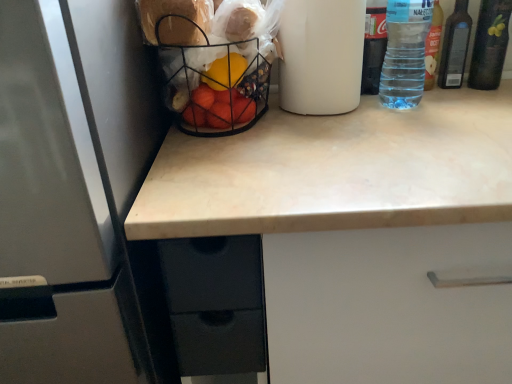
Find the location of a particular element. This screenshot has height=384, width=512. transparent plastic bottle at upper right, arranged as the 3th bottle when viewed from the right is located at coordinates (405, 53).

What do you see at coordinates (490, 44) in the screenshot? Image resolution: width=512 pixels, height=384 pixels. I see `dark green glass bottle at upper right, the 1th bottle in the right-to-left sequence` at bounding box center [490, 44].

What do you see at coordinates (455, 47) in the screenshot? I see `clear plastic bottle at upper right, the second bottle positioned from the right` at bounding box center [455, 47].

You are a GUI agent. You are given a task and a screenshot of the screen. Output one action in this format:
    pyautogui.click(x=<x>, y=<y>)
    Task: Click on the transparent plastic bottle at upper right, the fourth bottle when ordered from right to left
    The height and width of the screenshot is (384, 512).
    Given the screenshot: What is the action you would take?
    [373, 49]

Locate an element on the screen. The width and height of the screenshot is (512, 384). beige marble countertop at center is located at coordinates (359, 232).

The width and height of the screenshot is (512, 384). In order to click on transparent plastic bottle at upper right, arranged as the 3th bottle when viewed from the right in this screenshot , I will do `click(405, 53)`.

Is transparent plastic bottle at upper right, which ranks as the 1th bottle in left-to-right order, looking in the opposite direction of wire mesh basket at center?

transparent plastic bottle at upper right, which ranks as the 1th bottle in left-to-right order, is not turned away from wire mesh basket at center.

Is point (362, 69) farther from camera compared to point (248, 127)?

That is True.

Is transparent plastic bottle at upper right, which ranks as the 1th bottle in left-to-right order, wider or thinner than wire mesh basket at center?

Considering their sizes, transparent plastic bottle at upper right, which ranks as the 1th bottle in left-to-right order, looks slimmer than wire mesh basket at center.

Does transparent plastic bottle at upper right, the fourth bottle when ordered from right to left, have a larger size compared to wire mesh basket at center?

No, transparent plastic bottle at upper right, the fourth bottle when ordered from right to left, is not bigger than wire mesh basket at center.

Does wire mesh basket at center turn towards transparent plastic bottle at upper right, arranged as the 3th bottle when viewed from the right?

No, wire mesh basket at center does not turn towards transparent plastic bottle at upper right, arranged as the 3th bottle when viewed from the right.

Considering the relative positions of wire mesh basket at center and transparent plastic bottle at upper right, arranged as the 3th bottle when viewed from the right, in the image provided, is wire mesh basket at center to the left of transparent plastic bottle at upper right, arranged as the 3th bottle when viewed from the right, from the viewer's perspective?

Correct, you'll find wire mesh basket at center to the left of transparent plastic bottle at upper right, arranged as the 3th bottle when viewed from the right.

Is point (249, 122) farther from camera compared to point (413, 100)?

That is False.

Based on the photo, is clear plastic bottle at upper right, positioned as the third bottle in left-to-right order, positioned beyond the bounds of dark green glass bottle at upper right, the 1th bottle in the right-to-left sequence?

Yes, clear plastic bottle at upper right, positioned as the third bottle in left-to-right order, is located beyond the bounds of dark green glass bottle at upper right, the 1th bottle in the right-to-left sequence.

From a real-world perspective, between clear plastic bottle at upper right, the second bottle positioned from the right, and dark green glass bottle at upper right, which is the 4th bottle in left-to-right order, who is vertically lower?

From a 3D spatial view, clear plastic bottle at upper right, the second bottle positioned from the right, is below.

Find the location of a particular element. bottle that is the 2nd one when counting upward from the clear plastic bottle at upper right, positioned as the third bottle in left-to-right order (from the image's perspective) is located at coordinates (490, 44).

Does clear plastic bottle at upper right, the second bottle positioned from the right, have a greater height compared to dark green glass bottle at upper right, which is the 4th bottle in left-to-right order?

Incorrect, the height of clear plastic bottle at upper right, the second bottle positioned from the right, is not larger of that of dark green glass bottle at upper right, which is the 4th bottle in left-to-right order.

This screenshot has width=512, height=384. In order to click on the 1st bottle located beneath the transparent plastic bottle at upper right, arranged as the 3th bottle when viewed from the right (from a real-world perspective) in this screenshot , I will do `click(373, 49)`.

Between transparent plastic bottle at upper right, which ranks as the 1th bottle in left-to-right order, and transparent plastic bottle at upper right, arranged as the 3th bottle when viewed from the right, which one appears on the left side from the viewer's perspective?

From the viewer's perspective, transparent plastic bottle at upper right, which ranks as the 1th bottle in left-to-right order, appears more on the left side.

Considering the sizes of objects transparent plastic bottle at upper right, which ranks as the 1th bottle in left-to-right order, and transparent plastic bottle at upper right, arranged as the 3th bottle when viewed from the right, in the image provided, who is thinner, transparent plastic bottle at upper right, which ranks as the 1th bottle in left-to-right order, or transparent plastic bottle at upper right, arranged as the 3th bottle when viewed from the right,?

Thinner between the two is transparent plastic bottle at upper right, which ranks as the 1th bottle in left-to-right order.

Is transparent plastic bottle at upper right, arranged as the 2th bottle when viewed from the left, at the back of transparent plastic bottle at upper right, which ranks as the 1th bottle in left-to-right order?

transparent plastic bottle at upper right, which ranks as the 1th bottle in left-to-right order, is not turned away from transparent plastic bottle at upper right, arranged as the 2th bottle when viewed from the left.

Is satin white refrigerator at left to the left or to the right of transparent plastic bottle at upper right, arranged as the 3th bottle when viewed from the right, in the image?

From the image, it's evident that satin white refrigerator at left is to the left of transparent plastic bottle at upper right, arranged as the 3th bottle when viewed from the right.

Starting from the satin white refrigerator at left, which bottle is the 1st one behind? Please provide its 2D coordinates.

[(405, 53)]

Would you say satin white refrigerator at left is outside transparent plastic bottle at upper right, arranged as the 3th bottle when viewed from the right?

Indeed, satin white refrigerator at left is completely outside transparent plastic bottle at upper right, arranged as the 3th bottle when viewed from the right.

Who is taller, satin white refrigerator at left or transparent plastic bottle at upper right, arranged as the 2th bottle when viewed from the left?

A: Standing taller between the two is satin white refrigerator at left.

Which object is wider, clear plastic bottle at upper right, positioned as the third bottle in left-to-right order, or transparent plastic bottle at upper right, which ranks as the 1th bottle in left-to-right order?

With larger width is transparent plastic bottle at upper right, which ranks as the 1th bottle in left-to-right order.

Which is correct: clear plastic bottle at upper right, the second bottle positioned from the right, is inside transparent plastic bottle at upper right, the fourth bottle when ordered from right to left, or outside of it?

clear plastic bottle at upper right, the second bottle positioned from the right, lies outside transparent plastic bottle at upper right, the fourth bottle when ordered from right to left.

From a real-world perspective, is clear plastic bottle at upper right, the second bottle positioned from the right, positioned above or below transparent plastic bottle at upper right, the fourth bottle when ordered from right to left?

clear plastic bottle at upper right, the second bottle positioned from the right, is below transparent plastic bottle at upper right, the fourth bottle when ordered from right to left.

Is clear plastic bottle at upper right, the second bottle positioned from the right, shorter than transparent plastic bottle at upper right, which ranks as the 1th bottle in left-to-right order?

Yes.

Can you confirm if transparent plastic bottle at upper right, arranged as the 2th bottle when viewed from the left, is shorter than clear plastic bottle at upper right, positioned as the third bottle in left-to-right order?

Incorrect, the height of transparent plastic bottle at upper right, arranged as the 2th bottle when viewed from the left, does not fall short of that of clear plastic bottle at upper right, positioned as the third bottle in left-to-right order.

Is transparent plastic bottle at upper right, arranged as the 3th bottle when viewed from the right, positioned far away from clear plastic bottle at upper right, positioned as the third bottle in left-to-right order?

That's not correct — transparent plastic bottle at upper right, arranged as the 3th bottle when viewed from the right, is a little close to clear plastic bottle at upper right, positioned as the third bottle in left-to-right order.

From the image's perspective, would you say transparent plastic bottle at upper right, arranged as the 3th bottle when viewed from the right, is shown under clear plastic bottle at upper right, positioned as the third bottle in left-to-right order?

Yes, from the image's perspective, transparent plastic bottle at upper right, arranged as the 3th bottle when viewed from the right, is beneath clear plastic bottle at upper right, positioned as the third bottle in left-to-right order.

Is transparent plastic bottle at upper right, arranged as the 2th bottle when viewed from the left, facing away from clear plastic bottle at upper right, the second bottle positioned from the right?

That's not correct — transparent plastic bottle at upper right, arranged as the 2th bottle when viewed from the left, is not looking away from clear plastic bottle at upper right, the second bottle positioned from the right.

At what (x,y) coordinates should I click in order to perform the action: click on basket on the left side of transparent plastic bottle at upper right, the fourth bottle when ordered from right to left. Please return your answer as a coordinate pair (x, y). This screenshot has width=512, height=384. Looking at the image, I should click on (214, 84).

You are a GUI agent. You are given a task and a screenshot of the screen. Output one action in this format:
    pyautogui.click(x=<x>, y=<y>)
    Task: Click on the basket in front of the transparent plastic bottle at upper right, arranged as the 3th bottle when viewed from the right
    
    Given the screenshot: What is the action you would take?
    pos(214,84)

Estimate the real-world distances between objects in this image. Which object is closer to clear plastic bottle at upper right, positioned as the third bottle in left-to-right order, beige marble countertop at center or dark green glass bottle at upper right, which is the 4th bottle in left-to-right order?

dark green glass bottle at upper right, which is the 4th bottle in left-to-right order, lies closer to clear plastic bottle at upper right, positioned as the third bottle in left-to-right order, than the other object.

Looking at the image, which one is located closer to clear plastic bottle at upper right, the second bottle positioned from the right, dark green glass bottle at upper right, the 1th bottle in the right-to-left sequence, or wire mesh basket at center?

dark green glass bottle at upper right, the 1th bottle in the right-to-left sequence.

Looking at the image, which one is located closer to transparent plastic bottle at upper right, arranged as the 3th bottle when viewed from the right, wire mesh basket at center or transparent plastic bottle at upper right, the fourth bottle when ordered from right to left?

The object closer to transparent plastic bottle at upper right, arranged as the 3th bottle when viewed from the right, is transparent plastic bottle at upper right, the fourth bottle when ordered from right to left.

Considering their positions, is clear plastic bottle at upper right, positioned as the third bottle in left-to-right order, positioned further to dark green glass bottle at upper right, which is the 4th bottle in left-to-right order, than transparent plastic bottle at upper right, arranged as the 2th bottle when viewed from the left?

transparent plastic bottle at upper right, arranged as the 2th bottle when viewed from the left.

Considering their positions, is transparent plastic bottle at upper right, arranged as the 2th bottle when viewed from the left, positioned further to clear plastic bottle at upper right, the second bottle positioned from the right, than satin white refrigerator at left?

Based on the image, satin white refrigerator at left appears to be further to clear plastic bottle at upper right, the second bottle positioned from the right.

Considering their positions, is satin white refrigerator at left positioned closer to dark green glass bottle at upper right, which is the 4th bottle in left-to-right order, than beige marble countertop at center?

beige marble countertop at center.

Considering their positions, is transparent plastic bottle at upper right, the fourth bottle when ordered from right to left, positioned closer to clear plastic bottle at upper right, the second bottle positioned from the right, than transparent plastic bottle at upper right, arranged as the 3th bottle when viewed from the right?

The object closer to clear plastic bottle at upper right, the second bottle positioned from the right, is transparent plastic bottle at upper right, the fourth bottle when ordered from right to left.

Based on their spatial positions, is transparent plastic bottle at upper right, the fourth bottle when ordered from right to left, or beige marble countertop at center closer to dark green glass bottle at upper right, the 1th bottle in the right-to-left sequence?

transparent plastic bottle at upper right, the fourth bottle when ordered from right to left.

Locate an element on the screen. basket between clear plastic bottle at upper right, the second bottle positioned from the right, and beige marble countertop at center vertically is located at coordinates (214, 84).

This screenshot has width=512, height=384. I want to click on countertop between satin white refrigerator at left and clear plastic bottle at upper right, positioned as the third bottle in left-to-right order, so click(x=359, y=232).

This screenshot has height=384, width=512. Find the location of `basket between dark green glass bottle at upper right, which is the 4th bottle in left-to-right order, and beige marble countertop at center from top to bottom`. basket between dark green glass bottle at upper right, which is the 4th bottle in left-to-right order, and beige marble countertop at center from top to bottom is located at coordinates (214, 84).

Identify the location of basket between satin white refrigerator at left and transparent plastic bottle at upper right, arranged as the 2th bottle when viewed from the left, from left to right. (214, 84).